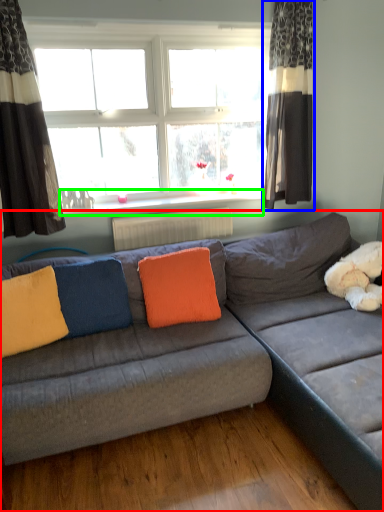
Question: Considering the real-world distances, which object is farthest from studio couch (highlighted by a red box)? curtain (highlighted by a blue box) or window sill (highlighted by a green box)?

Choices:
 (A) curtain
 (B) window sill

Answer: (B)